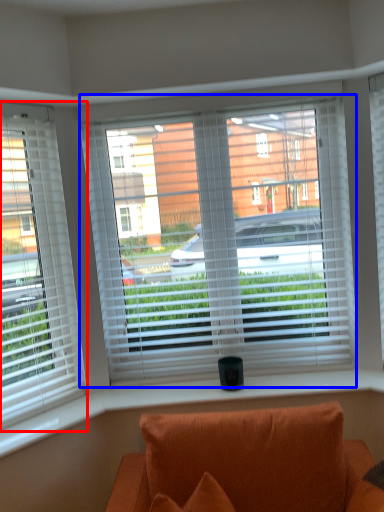
Question: Which of the following is the farthest to the observer, window (highlighted by a red box) or window (highlighted by a blue box)?

Choices:
 (A) window
 (B) window

Answer: (B)